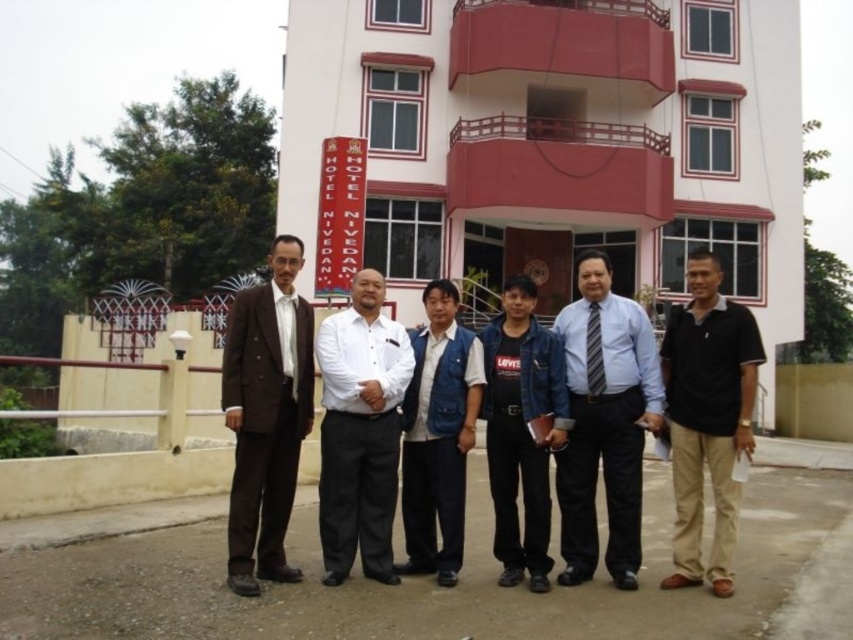
Question: Is brown fabric suit at left positioned at the back of striped fabric tie at center?

Choices:
 (A) no
 (B) yes

Answer: (A)

Question: Which point appears closest to the camera in this image?

Choices:
 (A) (596, 317)
 (B) (450, 376)
 (C) (604, 285)
 (D) (437, 68)

Answer: (B)

Question: Considering the real-world distances, which object is farthest from the white shirt at center?

Choices:
 (A) striped fabric tie at center
 (B) white painted building at center
 (C) denim jacket at center
 (D) black cotton polo shirt at right

Answer: (B)

Question: Which point is closer to the camera?

Choices:
 (A) (457, 515)
 (B) (376, 493)
 (C) (296, 161)

Answer: (B)

Question: Observing the image, what is the correct spatial positioning of blue denim vest at center in reference to striped fabric tie at center?

Choices:
 (A) below
 (B) above

Answer: (A)

Question: Is the position of white painted building at center more distant than that of white shirt at center?

Choices:
 (A) no
 (B) yes

Answer: (B)